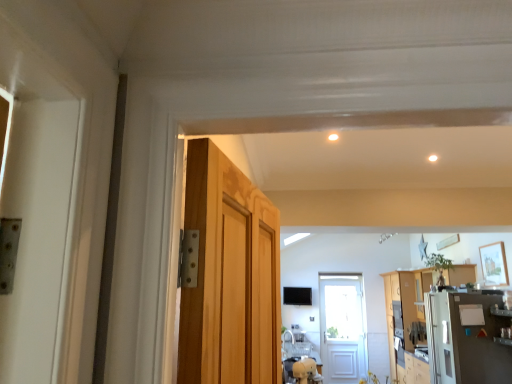
Question: From the image's perspective, is satin silver refrigerator at right located above or below white glossy light at upper center?

Choices:
 (A) above
 (B) below

Answer: (B)

Question: Does point (488, 364) appear closer or farther from the camera than point (335, 139)?

Choices:
 (A) farther
 (B) closer

Answer: (A)

Question: Estimate the real-world distances between objects in this image. Which object is farther from the white glossy light at upper center?

Choices:
 (A) wooden cabinet at right
 (B) satin silver refrigerator at right

Answer: (A)

Question: Which is farther from the wooden cabinet at right?

Choices:
 (A) satin silver refrigerator at right
 (B) white glossy light at upper center

Answer: (B)